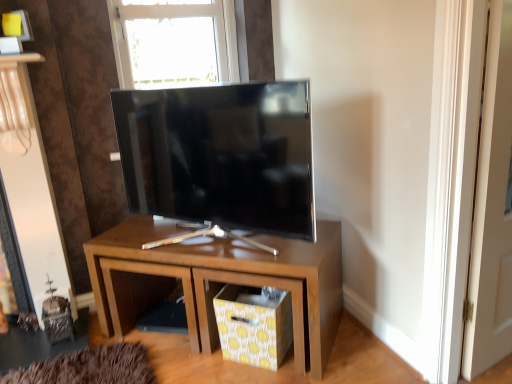
The height and width of the screenshot is (384, 512). Identify the location of transparent glass window at upper center. (174, 41).

Measure the distance between matte wood nightstand at center and camera.

matte wood nightstand at center is 1.45 meters away from camera.

Find the location of `yellow dotted fabric drawer at lower center`. yellow dotted fabric drawer at lower center is located at coordinates (254, 324).

From the image's perspective, does transparent glass window at upper center appear higher than matte black tv at center?

Yes, from the image's perspective, transparent glass window at upper center is above matte black tv at center.

Is transparent glass window at upper center oriented towards matte black tv at center?

Yes, transparent glass window at upper center is aimed at matte black tv at center.

From a real-world perspective, is transparent glass window at upper center above or below matte black tv at center?

Clearly, from a real-world perspective, transparent glass window at upper center is above matte black tv at center.

In order to click on window behind the matte black tv at center in this screenshot , I will do `click(174, 41)`.

From the image's perspective, does matte black tv at center appear lower than transparent glass window at upper center?

Correct, matte black tv at center appears lower than transparent glass window at upper center in the image.

Would you consider matte black tv at center to be distant from transparent glass window at upper center?

No, matte black tv at center is in close proximity to transparent glass window at upper center.

Based on the photo, from a real-world perspective, is matte black tv at center above or below transparent glass window at upper center?

matte black tv at center is situated lower than transparent glass window at upper center in the real world.

From a real-world perspective, who is located higher, matte black tv at center or yellow dotted fabric drawer at lower center?

matte black tv at center is physically above.

From the image's perspective, is matte black tv at center on yellow dotted fabric drawer at lower center?

Yes, from the image's perspective, matte black tv at center is above yellow dotted fabric drawer at lower center.

Considering the relative sizes of matte black tv at center and yellow dotted fabric drawer at lower center in the image provided, is matte black tv at center bigger than yellow dotted fabric drawer at lower center?

Indeed, matte black tv at center has a larger size compared to yellow dotted fabric drawer at lower center.

Does yellow dotted fabric drawer at lower center come in front of matte black tv at center?

No, yellow dotted fabric drawer at lower center is further to the viewer.

Between yellow dotted fabric drawer at lower center and matte black tv at center, which one has larger size?

matte black tv at center is bigger.

Is yellow dotted fabric drawer at lower center outside of matte black tv at center?

Indeed, yellow dotted fabric drawer at lower center is completely outside matte black tv at center.

In the image, there is a matte black tv at center. Where is `drawer below it (from a real-world perspective)`? The width and height of the screenshot is (512, 384). drawer below it (from a real-world perspective) is located at coordinates (254, 324).

Where is `nightstand that is under the matte black tv at center (from a real-world perspective)`? nightstand that is under the matte black tv at center (from a real-world perspective) is located at coordinates (218, 281).

From a real-world perspective, which object stands above the other?

matte black tv at center is physically above.

Considering the sizes of matte wood nightstand at center and matte black tv at center in the image, is matte wood nightstand at center bigger or smaller than matte black tv at center?

Considering their sizes, matte wood nightstand at center takes up more space than matte black tv at center.

Is matte wood nightstand at center next to matte black tv at center?

No, matte wood nightstand at center is not in contact with matte black tv at center.

In the scene shown: Looking at their sizes, would you say transparent glass window at upper center is wider or thinner than matte wood nightstand at center?

Considering their sizes, transparent glass window at upper center looks slimmer than matte wood nightstand at center.

Could you tell me if transparent glass window at upper center is turned towards matte wood nightstand at center?

No, transparent glass window at upper center is not oriented towards matte wood nightstand at center.

From the image's perspective, which is below, transparent glass window at upper center or matte wood nightstand at center?

From the image's view, matte wood nightstand at center is below.

Is transparent glass window at upper center not close to matte wood nightstand at center?

Yes, transparent glass window at upper center and matte wood nightstand at center are quite far apart.

Image resolution: width=512 pixels, height=384 pixels. Find the location of `nightstand located on the right of matte black tv at center`. nightstand located on the right of matte black tv at center is located at coordinates [x=218, y=281].

Is point (240, 218) positioned in front of point (307, 270)?

No, (240, 218) is behind (307, 270).

How many degrees apart are the facing directions of matte black tv at center and matte wood nightstand at center?

They differ by 16.5 degrees in their facing directions.

Which is more to the right, matte black tv at center or matte wood nightstand at center?

matte wood nightstand at center is more to the right.

In order to click on television on the right side of transparent glass window at upper center in this screenshot , I will do `click(220, 155)`.

This screenshot has height=384, width=512. What are the coordinates of `window above the matte black tv at center (from a real-world perspective)` in the screenshot? It's located at (174, 41).

Which object lies nearer to the anchor point matte black tv at center, transparent glass window at upper center or yellow dotted fabric drawer at lower center?

yellow dotted fabric drawer at lower center is closer to matte black tv at center.

Based on their spatial positions, is matte wood nightstand at center or transparent glass window at upper center closer to matte black tv at center?

matte wood nightstand at center is closer to matte black tv at center.

Looking at the image, which one is located closer to transparent glass window at upper center, matte wood nightstand at center or matte black tv at center?

matte black tv at center is closer to transparent glass window at upper center.

From the image, which object appears to be farther from matte wood nightstand at center, transparent glass window at upper center or yellow dotted fabric drawer at lower center?

A: The object further to matte wood nightstand at center is transparent glass window at upper center.

Which object lies further to the anchor point yellow dotted fabric drawer at lower center, transparent glass window at upper center or matte wood nightstand at center?

Among the two, transparent glass window at upper center is located further to yellow dotted fabric drawer at lower center.

Which object lies nearer to the anchor point matte wood nightstand at center, matte black tv at center or yellow dotted fabric drawer at lower center?

The object closer to matte wood nightstand at center is yellow dotted fabric drawer at lower center.

When comparing their distances from yellow dotted fabric drawer at lower center, does matte wood nightstand at center or transparent glass window at upper center seem closer?

matte wood nightstand at center is positioned closer to the anchor yellow dotted fabric drawer at lower center.

When comparing their distances from transparent glass window at upper center, does matte black tv at center or yellow dotted fabric drawer at lower center seem further?

The object further to transparent glass window at upper center is yellow dotted fabric drawer at lower center.

Identify the location of television between transparent glass window at upper center and matte wood nightstand at center in the up-down direction. (220, 155).

Identify the location of television between transparent glass window at upper center and yellow dotted fabric drawer at lower center vertically. pyautogui.click(x=220, y=155).

Find the location of a particular element. Image resolution: width=512 pixels, height=384 pixels. nightstand that lies between matte black tv at center and yellow dotted fabric drawer at lower center from top to bottom is located at coordinates (218, 281).

The image size is (512, 384). Identify the location of nightstand that lies between transparent glass window at upper center and yellow dotted fabric drawer at lower center from top to bottom. (218, 281).